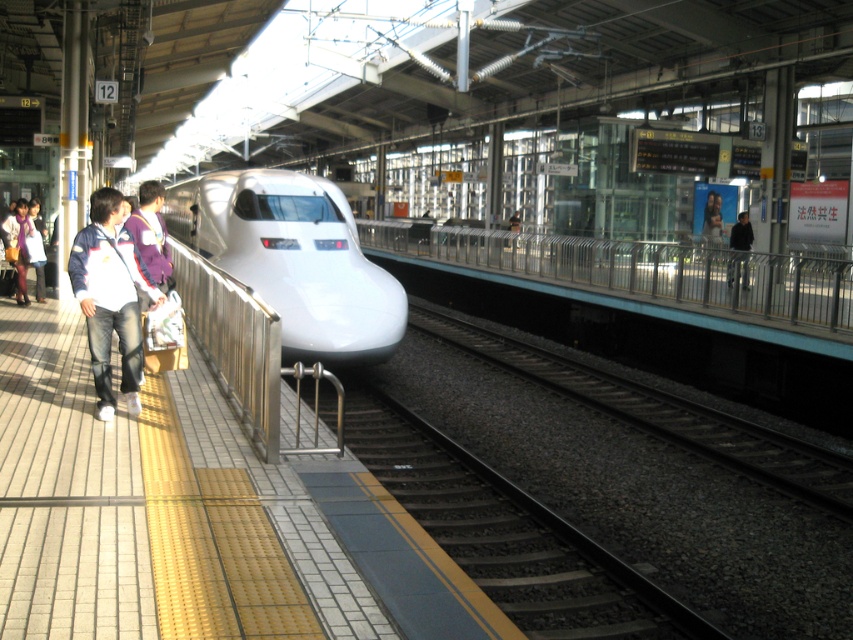
Question: Is metallic silver rail at center wider than white cotton jacket at left?

Choices:
 (A) yes
 (B) no

Answer: (A)

Question: Which point appears closest to the camera in this image?

Choices:
 (A) (310, 298)
 (B) (706, 317)
 (C) (16, 212)
 (D) (747, 259)

Answer: (A)

Question: Can you confirm if white glossy train at center is thinner than matte white jacket at left?

Choices:
 (A) yes
 (B) no

Answer: (B)

Question: Considering the relative positions of metallic silver rail at center and matte white jacket at left in the image provided, where is metallic silver rail at center located with respect to matte white jacket at left?

Choices:
 (A) left
 (B) right

Answer: (B)

Question: Based on their relative distances, which object is nearer to the dark blue jacket at right?

Choices:
 (A) white cotton jacket at left
 (B) white glossy train at center

Answer: (A)

Question: Among these points, which one is farthest from the camera?

Choices:
 (A) (410, 253)
 (B) (119, 234)

Answer: (A)